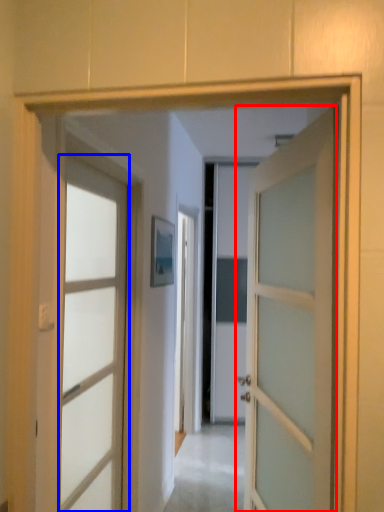
Question: Which object is closer to the camera taking this photo, door (highlighted by a red box) or door (highlighted by a blue box)?

Choices:
 (A) door
 (B) door

Answer: (A)